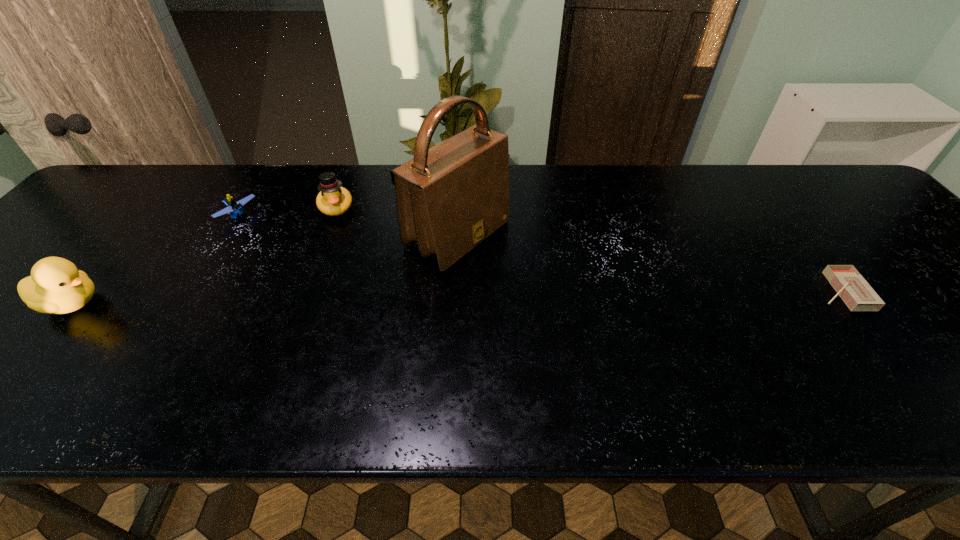
This screenshot has height=540, width=960. Identify the location of blank region between the shortest object and the left duck. tap(456, 297).

You are a GUI agent. You are given a task and a screenshot of the screen. Output one action in this format:
    pyautogui.click(x=<x>, y=<y>)
    Task: Click on the object that stands as the second closest to the farther duck
    The height and width of the screenshot is (540, 960).
    Given the screenshot: What is the action you would take?
    pyautogui.click(x=234, y=208)

Select which object appears as the second closest to the shortest object. Please provide its 2D coordinates. Your answer should be formatted as a tuple, i.e. [(x, y)], where the tuple contains the x and y coordinates of a point satisfying the conditions above.

[(333, 200)]